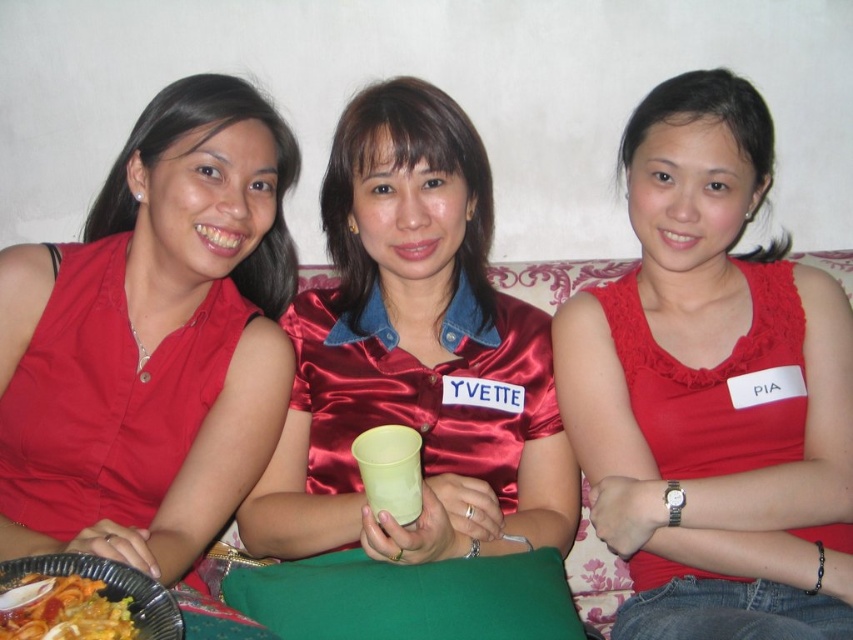
Between point (16, 547) and point (84, 605), which one is positioned behind?

The point (16, 547) is more distant.

Does point (186, 163) come farther from viewer compared to point (108, 636)?

That is True.

The height and width of the screenshot is (640, 853). In order to click on matte red dress at left in this screenshot , I will do click(x=154, y=339).

Which of these two, matte red dress at left or yellow matte cup at center, stands shorter?

Standing shorter between the two is yellow matte cup at center.

Does matte red dress at left have a smaller size compared to yellow matte cup at center?

Actually, matte red dress at left might be larger than yellow matte cup at center.

Between point (215, 484) and point (405, 488), which one is positioned behind?

Point (215, 484)

Where is `matte red dress at left`? This screenshot has height=640, width=853. matte red dress at left is located at coordinates (154, 339).

Is matte red dress at center behind yellow matte cup at center?

No, it is not.

At what (x,y) coordinates should I click in order to perform the action: click on matte red dress at center. Please return your answer as a coordinate pair (x, y). The height and width of the screenshot is (640, 853). Looking at the image, I should click on (712, 388).

This screenshot has width=853, height=640. What do you see at coordinates (712, 388) in the screenshot?
I see `matte red dress at center` at bounding box center [712, 388].

Identify the location of matte red dress at center. This screenshot has width=853, height=640. (712, 388).